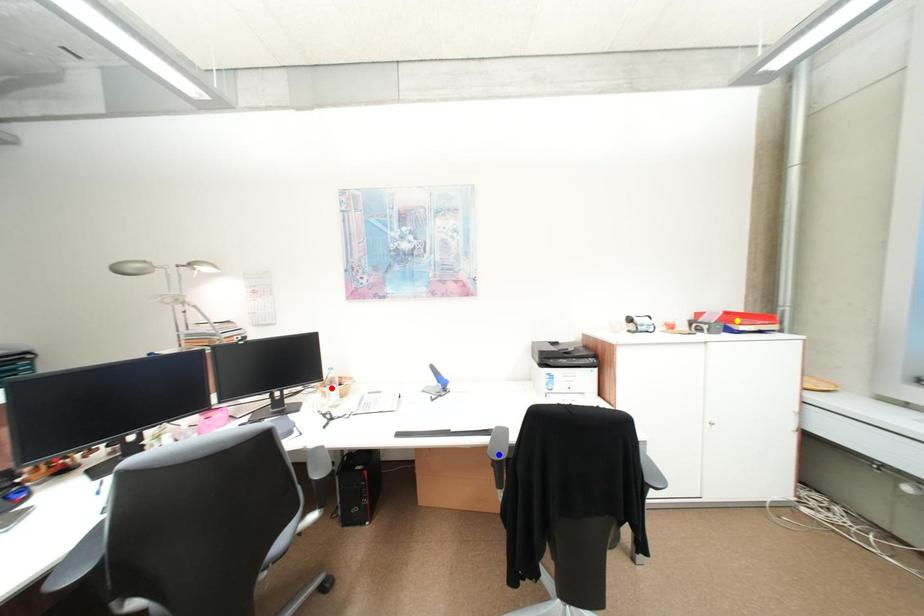
Order these from farthest to nearest:
1. red point
2. blue point
3. yellow point

red point < yellow point < blue point